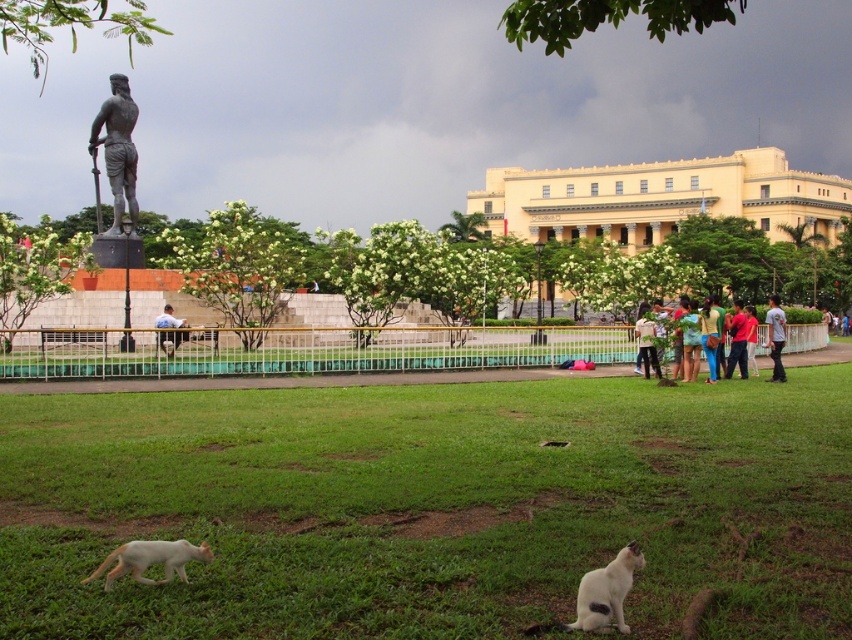
Which is in front, point (590, 621) or point (727, 328)?

Positioned in front is point (590, 621).

How distant is white fur cat at lower right from red fabric shirt at center?

The distance of white fur cat at lower right from red fabric shirt at center is 20.30 meters.

Image resolution: width=852 pixels, height=640 pixels. I want to click on white fur cat at lower right, so click(606, 592).

Who is positioned more to the left, white fur cat at lower right or light blue shirt at center?

light blue shirt at center is more to the left.

In order to click on white fur cat at lower right in this screenshot , I will do `click(606, 592)`.

Between green grass at center and bronze statue at upper left, which one has more height?

With more height is bronze statue at upper left.

Between green grass at center and bronze statue at upper left, which one has less height?

green grass at center is shorter.

The height and width of the screenshot is (640, 852). What do you see at coordinates (432, 508) in the screenshot? I see `green grass at center` at bounding box center [432, 508].

Identify the location of green grass at center. The image size is (852, 640). (432, 508).